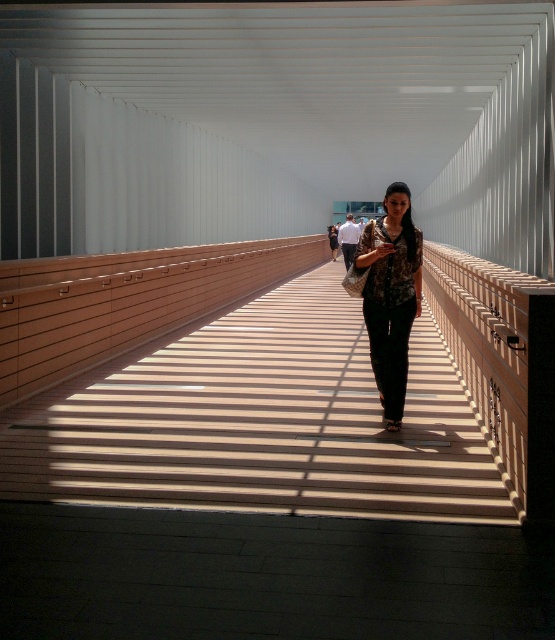
Question: Which point is farther to the camera?

Choices:
 (A) (382, 332)
 (B) (95, 480)

Answer: (A)

Question: Which of the following is the farthest from the observer?

Choices:
 (A) (416, 269)
 (B) (183, 451)

Answer: (A)

Question: Observing the image, what is the correct spatial positioning of wooden bridge at center in reference to floral fabric dress at center?

Choices:
 (A) left
 (B) right

Answer: (A)

Question: Is wooden bridge at center above floral fabric dress at center?

Choices:
 (A) no
 (B) yes

Answer: (A)

Question: Is the position of wooden bridge at center less distant than that of floral fabric dress at center?

Choices:
 (A) no
 (B) yes

Answer: (B)